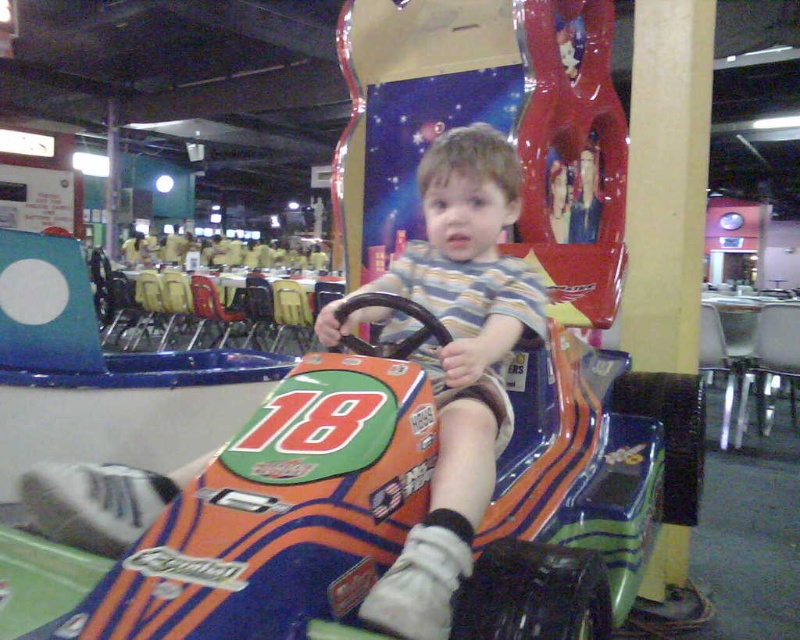
Question: Can you confirm if orange glossy toy car at center is positioned to the left of striped cotton shirt at center?

Choices:
 (A) no
 (B) yes

Answer: (A)

Question: Is the position of orange glossy toy car at center more distant than that of striped cotton shirt at center?

Choices:
 (A) yes
 (B) no

Answer: (B)

Question: Which of the following is the closest to the observer?

Choices:
 (A) striped cotton shirt at center
 (B) orange glossy toy car at center

Answer: (B)

Question: Which point is closer to the camera?

Choices:
 (A) striped cotton shirt at center
 (B) orange glossy toy car at center

Answer: (B)

Question: Can you confirm if orange glossy toy car at center is positioned below striped cotton shirt at center?

Choices:
 (A) yes
 (B) no

Answer: (A)